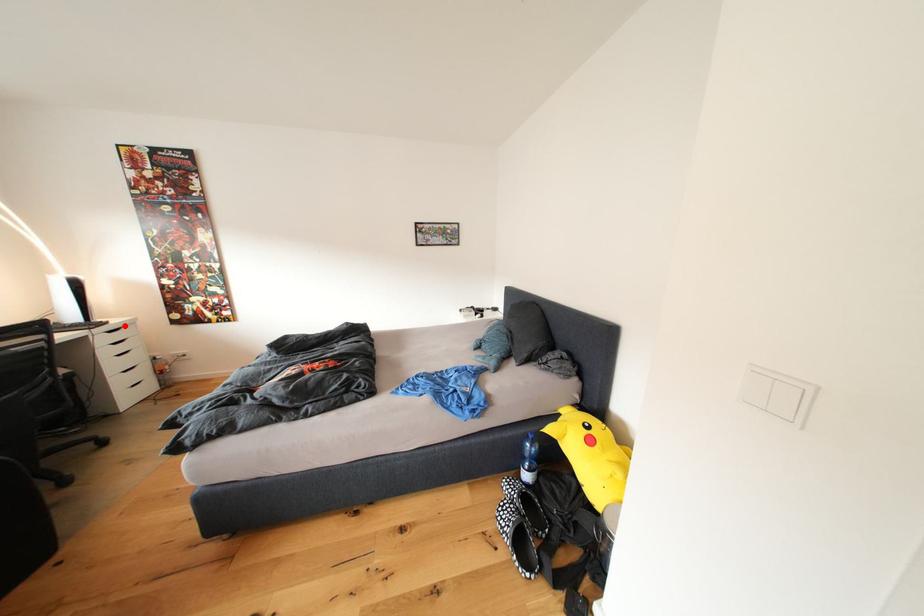
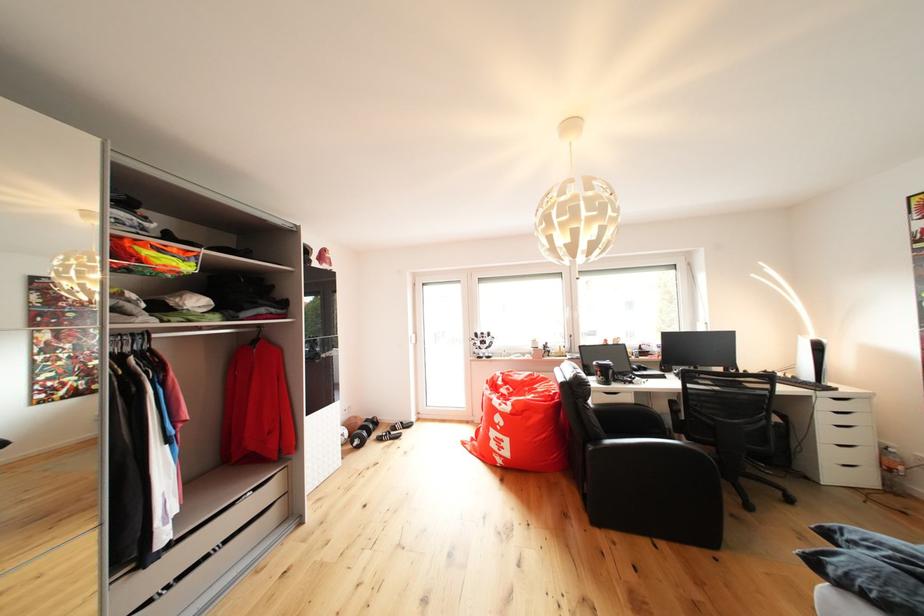
Question: I am providing you with two images of the same scene from different viewpoints. A red point is shown in image1. For the corresponding object point in image2, is it positioned nearer or farther from the camera?

Choices:
 (A) Nearer
 (B) Farther

Answer: (A)